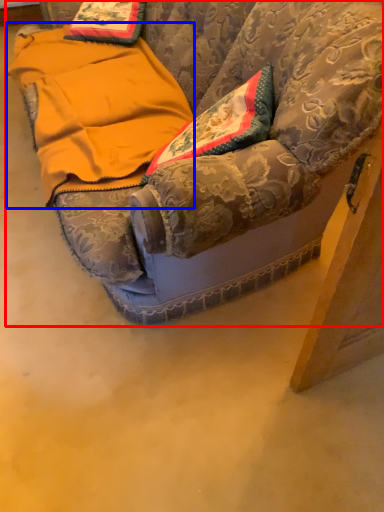
Question: Which object appears farthest to the camera in this image, furniture (highlighted by a red box) or blanket (highlighted by a blue box)?

Choices:
 (A) furniture
 (B) blanket

Answer: (B)